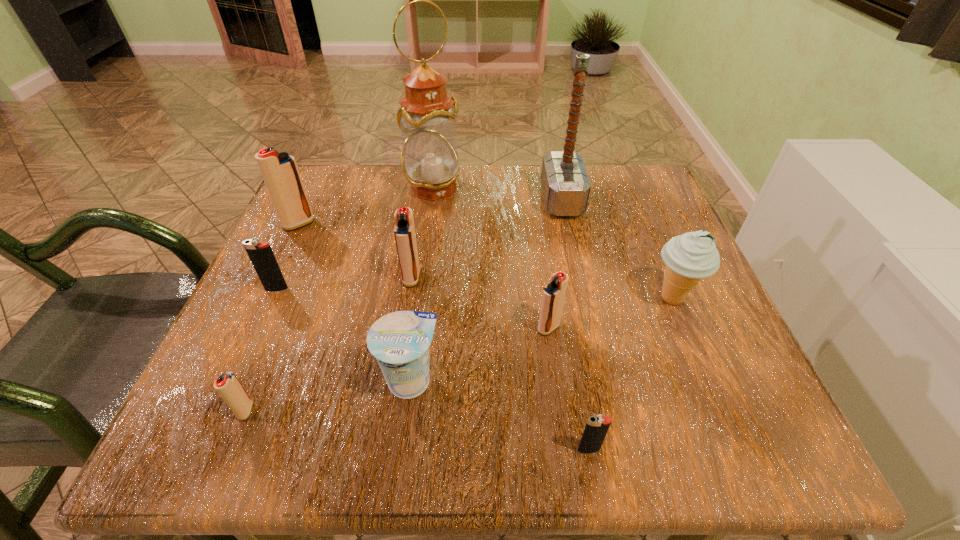
Where is `vacant space at the right edge of the desktop`? vacant space at the right edge of the desktop is located at coordinates (665, 228).

In the image, there is a desktop. Identify the location of blank space at the far left corner. (360, 203).

The image size is (960, 540). Find the location of `vacant space at the far right corner`. vacant space at the far right corner is located at coordinates (671, 218).

The height and width of the screenshot is (540, 960). In the image, there is a desktop. Identify the location of vacant area at the near right corner. (734, 438).

The height and width of the screenshot is (540, 960). I want to click on free spot between the oil lamp and the icecream, so click(x=553, y=243).

I want to click on vacant region between the second nearest igniter and the beige icecream, so click(459, 354).

This screenshot has height=540, width=960. I want to click on empty space between the second smallest red igniter and the oil lamp, so click(491, 258).

You are a GUI agent. You are given a task and a screenshot of the screen. Output one action in this format:
    pyautogui.click(x=<x>, y=<y>)
    Task: Click on the vacant space in between the icecream and the smaller black igniter
    Image resolution: width=960 pixels, height=540 pixels.
    Given the screenshot: What is the action you would take?
    pyautogui.click(x=631, y=374)

Identify the location of free space between the nearest red igniter and the tallest object. (340, 299).

Identify the location of empty space between the second tallest igniter and the bigger black igniter. This screenshot has width=960, height=540. (344, 283).